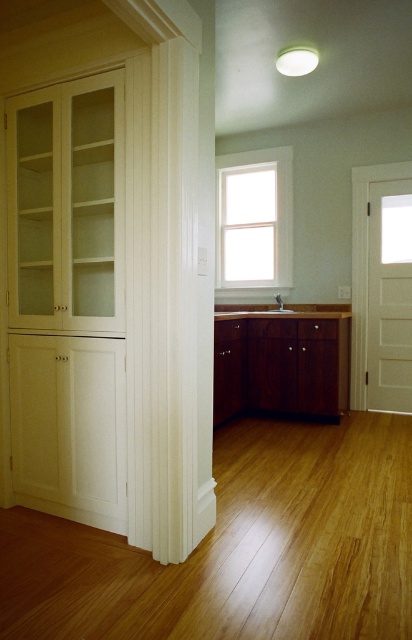
You are standing in the kitchen and want to take a photo of the mahogany wood cabinet at center. If your camera is 12.45 feet away from the cabinet, is it within the recommended 10 feet range for clear photos?

The mahogany wood cabinet at center and camera are 12.45 feet apart, which exceeds the recommended 10 feet range for clear photos. Move closer to ensure clarity.